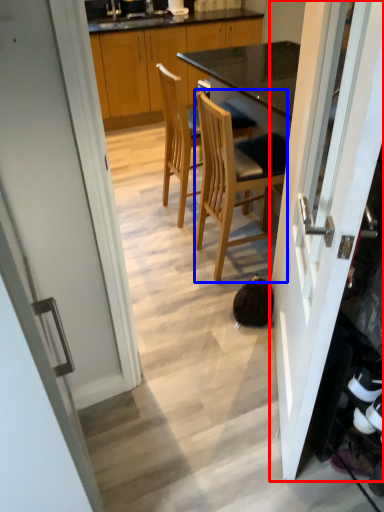
Question: Which object appears farthest to the camera in this image, door (highlighted by a red box) or chair (highlighted by a blue box)?

Choices:
 (A) door
 (B) chair

Answer: (B)